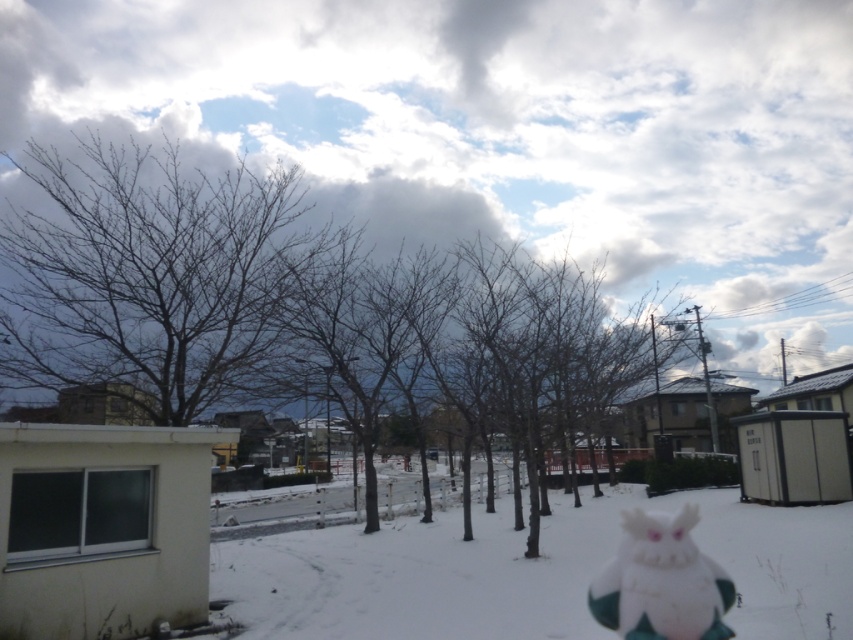
You are a photographer standing in the snowy scene and want to take a photo of both the point at (167, 410) and the point at (788, 566). Which point is closer to your camera?

Point (167, 410) is further to the camera than point (788, 566), so the point at (788, 566) is closer to your camera.

You are standing in the snowy scene and want to place a small decoration exactly at the location of the bare branches at left. What are the coordinates where you should place it?

The coordinates for placing the decoration at the location of the bare branches at left are (148, 273).